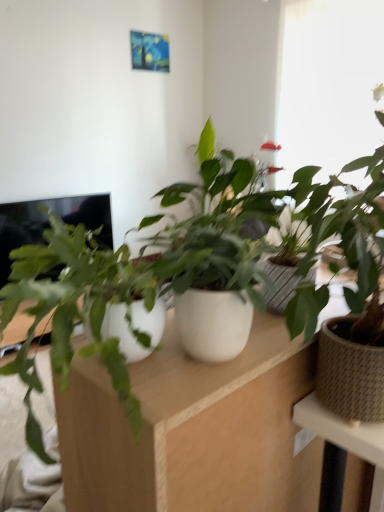
Question: Is black glossy screen at left bigger or smaller than brown woven pot at right, the 2th houseplant in the left-to-right sequence?

Choices:
 (A) small
 (B) big

Answer: (B)

Question: From the image's perspective, is black glossy screen at left located above or below brown woven pot at right, the 2th houseplant in the left-to-right sequence?

Choices:
 (A) below
 (B) above

Answer: (B)

Question: Considering the real-world distances, which object is closest to the black glossy screen at left?

Choices:
 (A) white matte computer desk at center
 (B) brown woven pot at right, the 2th houseplant in the left-to-right sequence
 (C) white matte pot at center, positioned as the 2th houseplant in right-to-left order
 (D) transparent glass window at upper right

Answer: (C)

Question: Which object is positioned farthest from the white matte pot at center, which ranks as the 1th houseplant in left-to-right order?

Choices:
 (A) black glossy screen at left
 (B) white matte computer desk at center
 (C) brown woven pot at right, the 1th houseplant viewed from the right
 (D) transparent glass window at upper right

Answer: (D)